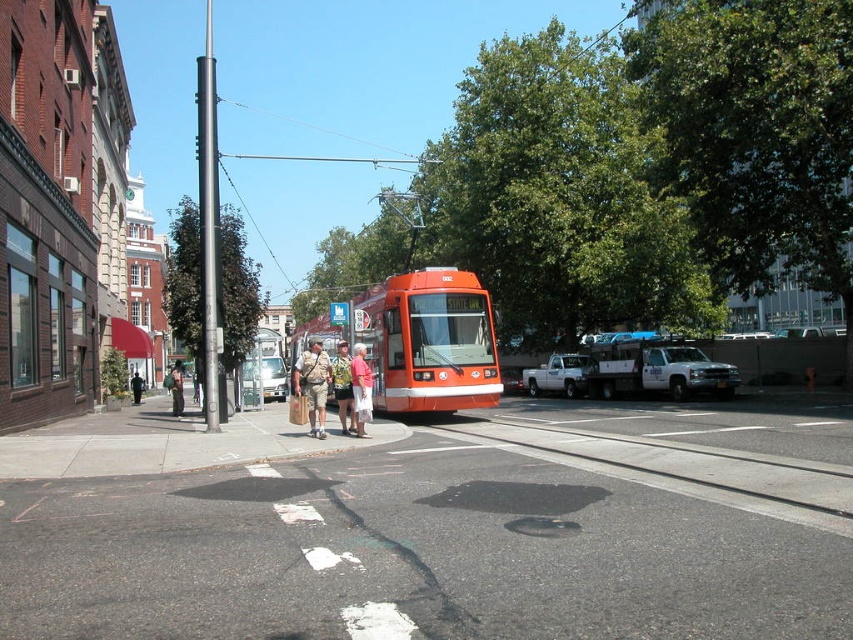
Question: Is red cotton shorts at center bigger than camouflage-patterned shorts at center?

Choices:
 (A) yes
 (B) no

Answer: (B)

Question: Which point is farther to the camera?

Choices:
 (A) (131, 392)
 (B) (387, 380)

Answer: (A)

Question: Estimate the real-world distances between objects in this image. Which object is farther from the red cotton shorts at center?

Choices:
 (A) camouflage shirt at center
 (B) khaki shorts at center

Answer: (B)

Question: Based on their relative distances, which object is nearer to the khaki shorts at center?

Choices:
 (A) white matte truck at right
 (B) camouflage backpack at center
 (C) camouflage shirt at center

Answer: (B)

Question: Does red cotton shorts at center appear on the left side of khaki shorts at center?

Choices:
 (A) yes
 (B) no

Answer: (B)

Question: Is red cotton shorts at center smaller than khaki shorts at center?

Choices:
 (A) yes
 (B) no

Answer: (A)